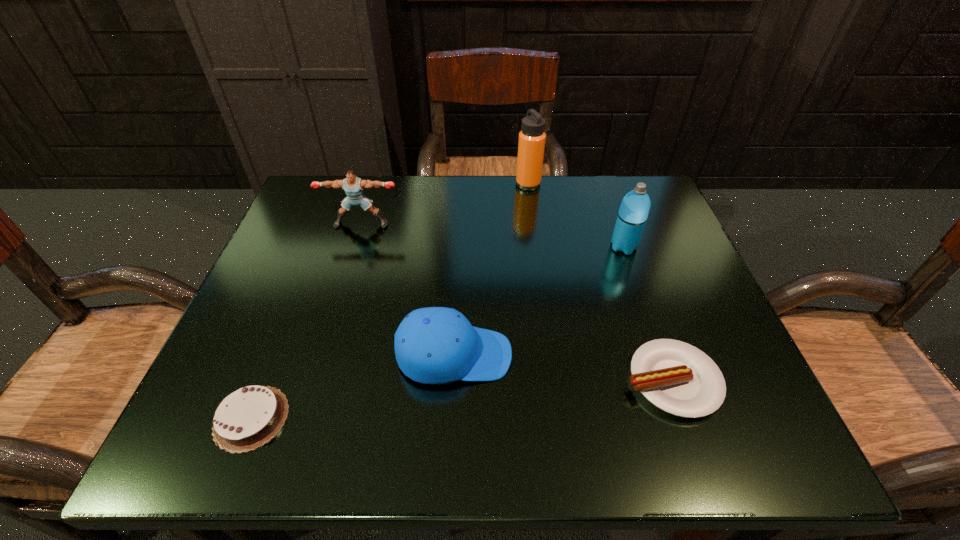
You are a GUI agent. You are given a task and a screenshot of the screen. Output one action in this format:
    pyautogui.click(x=<x>, y=<y>)
    Task: Click on the free spot between the sausage and the right thermos bottle
    
    Given the screenshot: What is the action you would take?
    pyautogui.click(x=648, y=314)

This screenshot has height=540, width=960. Find the location of `empty space between the farther thermos bottle and the puncher`. empty space between the farther thermos bottle and the puncher is located at coordinates (444, 204).

Where is `vacant area that lies between the puncher and the chocolate cake`? vacant area that lies between the puncher and the chocolate cake is located at coordinates (306, 321).

Image resolution: width=960 pixels, height=540 pixels. What are the coordinates of `object that is the closest to the nearer thermos bottle` in the screenshot? It's located at (531, 144).

You are a GUI agent. You are given a task and a screenshot of the screen. Output one action in this format:
    pyautogui.click(x=<x>, y=<y>)
    Task: Click on the object that is the closest one to the fifth tallest object
    
    Given the screenshot: What is the action you would take?
    pyautogui.click(x=434, y=345)

The image size is (960, 540). I want to click on vacant region that satisfies the following two spatial constraints: 1. on the front-facing side of the sausage; 2. on the left side of the fourth shortest object, so click(x=314, y=380).

Where is `free region that satisfies the following two spatial constraints: 1. on the front-facing side of the fourth tallest object; 2. on the left side of the sausage`? free region that satisfies the following two spatial constraints: 1. on the front-facing side of the fourth tallest object; 2. on the left side of the sausage is located at coordinates (453, 380).

Image resolution: width=960 pixels, height=540 pixels. Find the location of `free space that satisfies the following two spatial constraints: 1. on the front-facing side of the second shortest object; 2. on the left side of the fourth tallest object`. free space that satisfies the following two spatial constraints: 1. on the front-facing side of the second shortest object; 2. on the left side of the fourth tallest object is located at coordinates (453, 380).

The image size is (960, 540). Find the location of `free spot that satisfies the following two spatial constraints: 1. on the back side of the second shortest object; 2. on the left side of the shortest object`. free spot that satisfies the following two spatial constraints: 1. on the back side of the second shortest object; 2. on the left side of the shortest object is located at coordinates (266, 380).